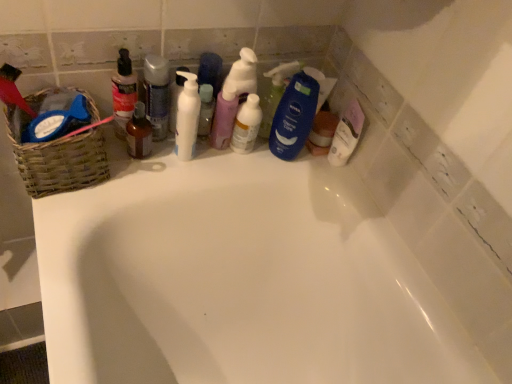
You are a GUI agent. You are given a task and a screenshot of the screen. Output one action in this format:
    pyautogui.click(x=<x>, y=<y>)
    Task: Click on the free space in front of translucent plastic bottle at upper left
    The height and width of the screenshot is (384, 512).
    Given the screenshot: What is the action you would take?
    pyautogui.click(x=103, y=195)